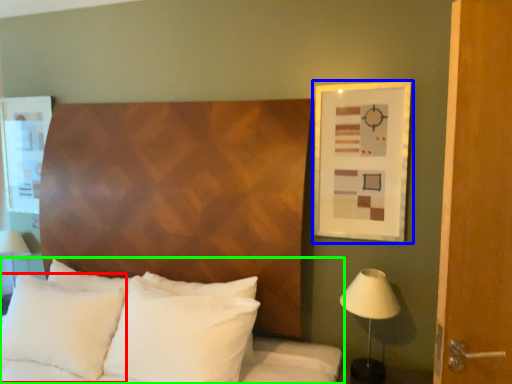
Question: Considering the real-world distances, which object is closest to pillow (highlighted by a red box)? picture frame (highlighted by a blue box) or bed (highlighted by a green box).

Choices:
 (A) picture frame
 (B) bed

Answer: (B)